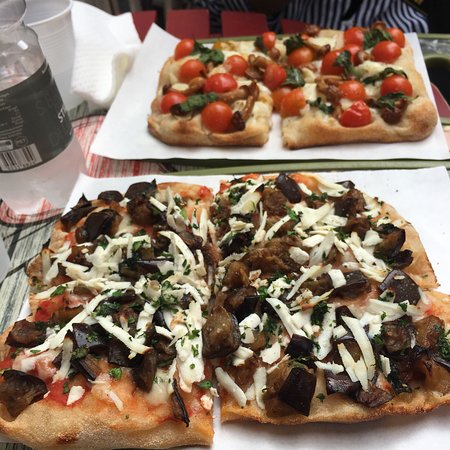
Locate an element on the screen. This screenshot has height=450, width=450. platemat is located at coordinates (15, 292), (89, 128).